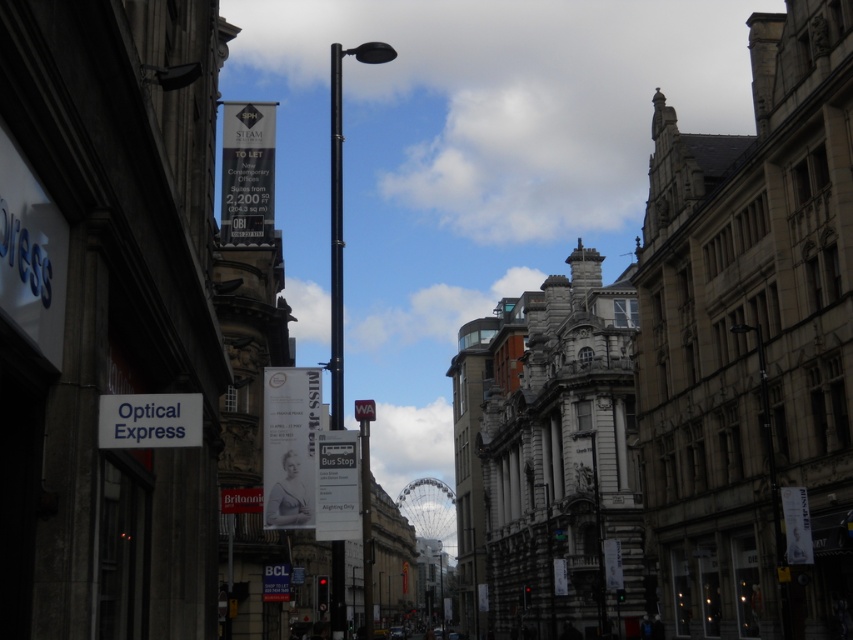
Question: Does white matte sign at lower left lie in front of white paper sign at lower center?

Choices:
 (A) no
 (B) yes

Answer: (B)

Question: Which object is farther from the camera taking this photo?

Choices:
 (A) white matte sign at lower left
 (B) white plastic street sign at center

Answer: (B)

Question: Is white matte sign at lower left bigger than white paper sign at lower center?

Choices:
 (A) yes
 (B) no

Answer: (B)

Question: Based on their relative distances, which object is farther from the white plastic street sign at center?

Choices:
 (A) white matte sign at lower left
 (B) black metal lamp post at center
 (C) white paper sign at lower center
 (D) black metal pole at center

Answer: (B)

Question: Which of these objects is positioned closest to the white matte sign at lower left?

Choices:
 (A) white paper sign at lower center
 (B) black metal pole at center

Answer: (A)

Question: From the image, what is the correct spatial relationship of black metal pole at center in relation to white plastic street sign at center?

Choices:
 (A) right
 (B) left

Answer: (B)